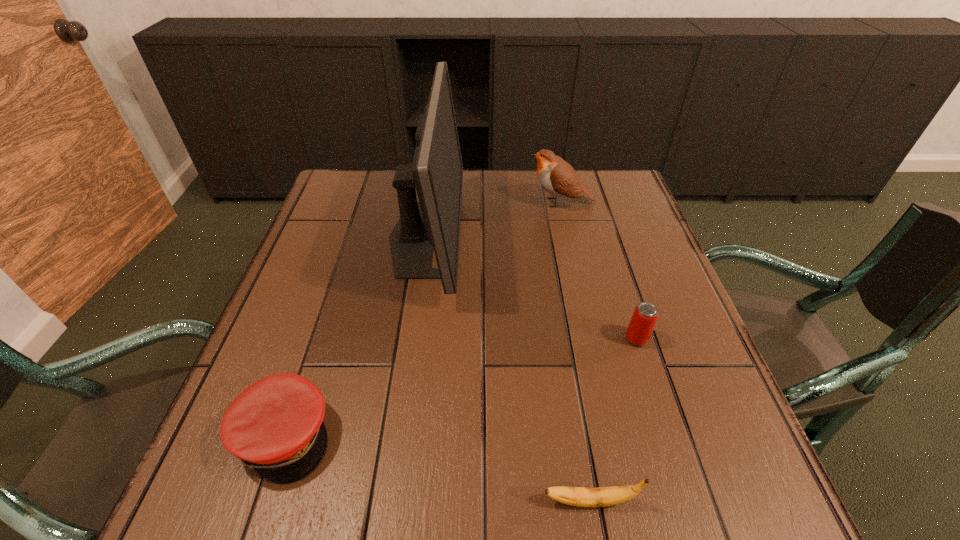
Where is `vacant space at the far right corner of the desktop`? The width and height of the screenshot is (960, 540). vacant space at the far right corner of the desktop is located at coordinates (612, 179).

Image resolution: width=960 pixels, height=540 pixels. Find the location of `unoccupied area between the computer monitor and the third farthest object`. unoccupied area between the computer monitor and the third farthest object is located at coordinates (531, 288).

Identify the location of free space between the bird and the beer can. (598, 271).

Where is `empty location between the third nearest object and the nearest object`? The height and width of the screenshot is (540, 960). empty location between the third nearest object and the nearest object is located at coordinates (613, 420).

Identify the location of vacant region between the computer monitor and the cap. The image size is (960, 540). (355, 337).

This screenshot has width=960, height=540. I want to click on free space between the tallest object and the second tallest object, so click(x=492, y=220).

Identify the location of empty space between the nearest object and the tallest object. The height and width of the screenshot is (540, 960). (508, 369).

I want to click on vacant area that lies between the bird and the tallest object, so click(492, 220).

You are a GUI agent. You are given a task and a screenshot of the screen. Output one action in this format:
    pyautogui.click(x=<x>, y=<y>)
    Task: Click on the vacant space in between the beer can and the nearest object
    
    Given the screenshot: What is the action you would take?
    pyautogui.click(x=613, y=420)

Locate an element on the screen. The image size is (960, 540). empty space between the tallest object and the nearest object is located at coordinates (508, 369).